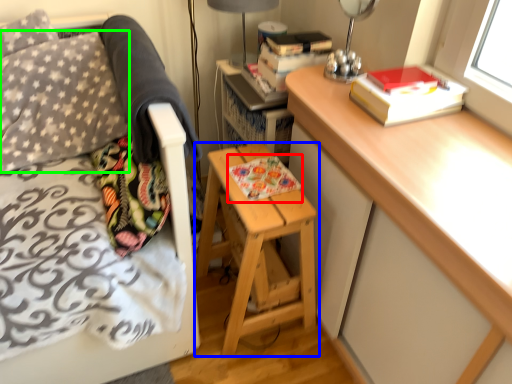
Question: Which object is the closest to the book (highlighted by a red box)? Choose among these: stool (highlighted by a blue box) or throw pillow (highlighted by a green box).

Choices:
 (A) stool
 (B) throw pillow

Answer: (A)